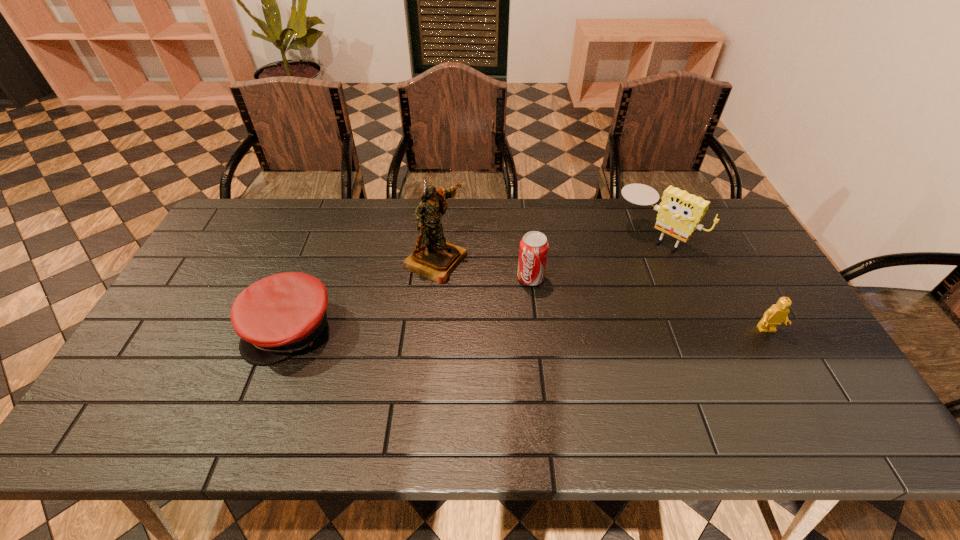
I want to click on cap, so click(x=277, y=316).

Locate an element on the screen. Image resolution: width=960 pixels, height=540 pixels. Lego is located at coordinates (778, 313).

Identify the location of soda can. (533, 252).

Where is `the third object from left to right`? The height and width of the screenshot is (540, 960). the third object from left to right is located at coordinates (533, 252).

I want to click on the fourth object from right to left, so click(x=434, y=258).

Image resolution: width=960 pixels, height=540 pixels. Find the location of `figurine`. figurine is located at coordinates (434, 258).

The width and height of the screenshot is (960, 540). What are the coordinates of `the fourth shortest object` in the screenshot? It's located at (679, 213).

Where is `the fourth object from left to right`? the fourth object from left to right is located at coordinates 679,213.

You are a GUI agent. You are given a task and a screenshot of the screen. Output one action in this format:
    pyautogui.click(x=<x>, y=<y>)
    Task: Click on the free space located 0.060m on the front-facing side of the cap
    
    Given the screenshot: What is the action you would take?
    pyautogui.click(x=269, y=388)

What are the coordinates of `vacant space located 0.120m on the face of the Lego` in the screenshot? It's located at (792, 376).